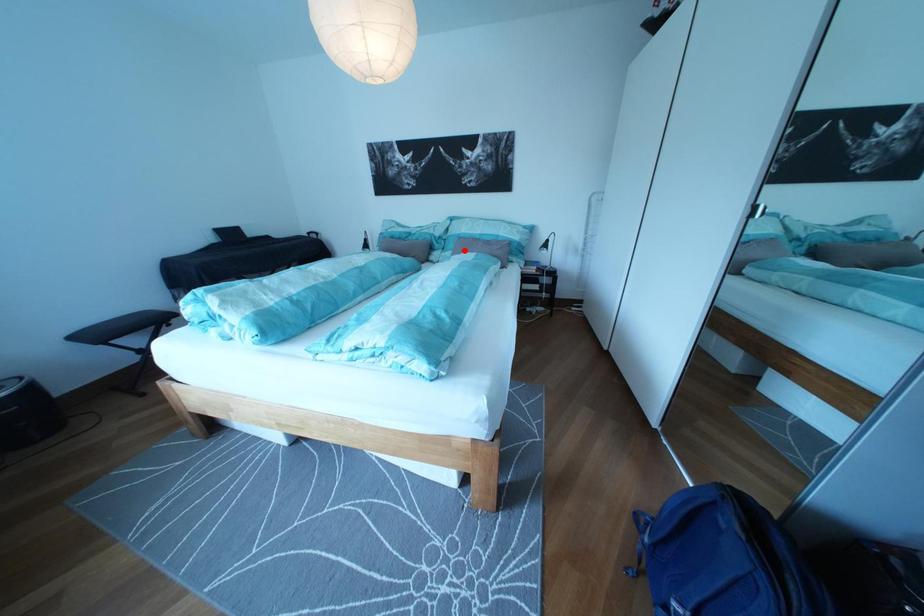
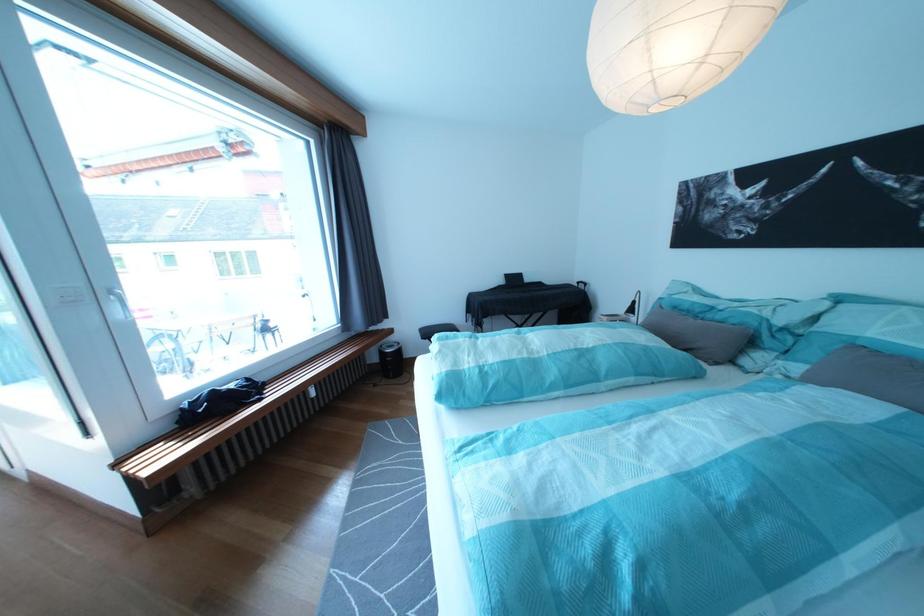
In the second image, find the point that corresponds to the highlighted location in the first image.

(825, 358)